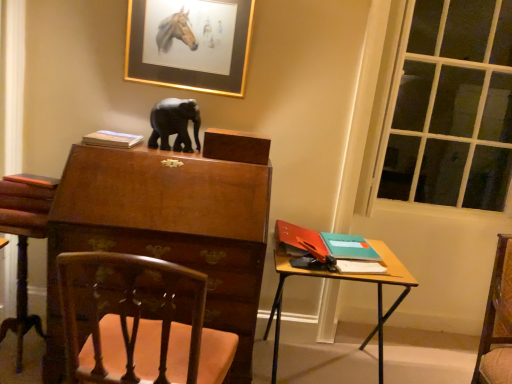
Question: Is transparent glass window at right wider or thinner than wooden carved chair at lower left?

Choices:
 (A) wide
 (B) thin

Answer: (B)

Question: From the image's perspective, is transparent glass window at right positioned above or below wooden carved chair at lower left?

Choices:
 (A) below
 (B) above

Answer: (B)

Question: Which object is the closest to the wooden carved chair at lower left?

Choices:
 (A) black glossy elephant at upper center
 (B) teal matte book at right, the 3th book from the left
 (C) matte paper book at upper left, the third book when ordered from right to left
 (D) wooden desk at right
 (E) gold-framed picture at upper center

Answer: (A)

Question: Estimate the real-world distances between objects in this image. Which object is closer to the orange matte book at right, positioned as the 2th book in left-to-right order?

Choices:
 (A) wooden desk at right
 (B) gold-framed picture at upper center
 (C) teal matte book at right, placed as the 1th book when sorted from right to left
 (D) wooden carved chair at lower left
 (E) wooden carved chair at lower left

Answer: (C)